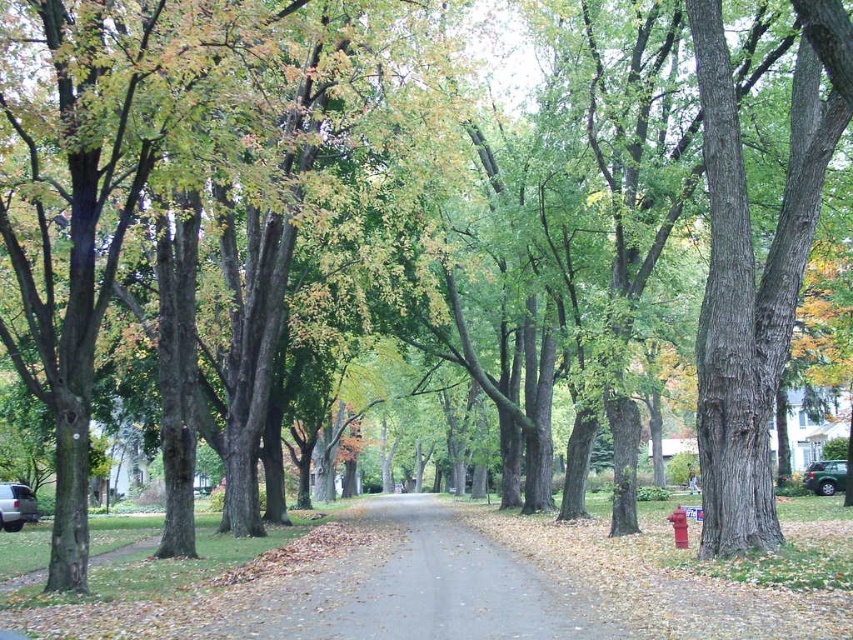
You are standing at the center of the road in the suburban street scene. You see a green matte car at lower right. Based on its 2D coordinates, is the car closer to the bottom or the right edge of the image?

The green matte car at lower right is located at point (825, 476). Since both coordinates are close to 1, which represents the bottom and right edges of the image, the car is closer to both edges. However, since the y coordinate is 0.968, which is closer to 1 than the x coordinate of 0.745, the car is slightly closer to the bottom edge of the image.

You are a delivery driver navigating a suburban area and need to locate the brown gravel alley at center. Based on the scene description, where would you find it?

The brown gravel alley at center is located at point (421,588).